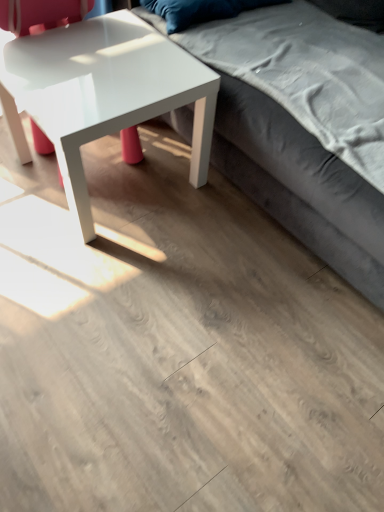
Locate an element on the screen. free space above glossy white coffee table at left (from a real-world perspective) is located at coordinates (96, 61).